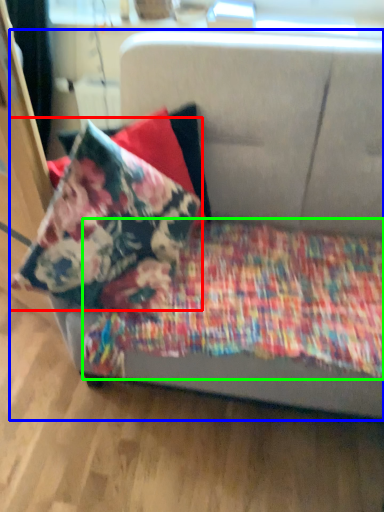
Question: Considering the real-world distances, which object is closest to pillow (highlighted by a red box)? studio couch (highlighted by a blue box) or blanket (highlighted by a green box).

Choices:
 (A) studio couch
 (B) blanket

Answer: (B)